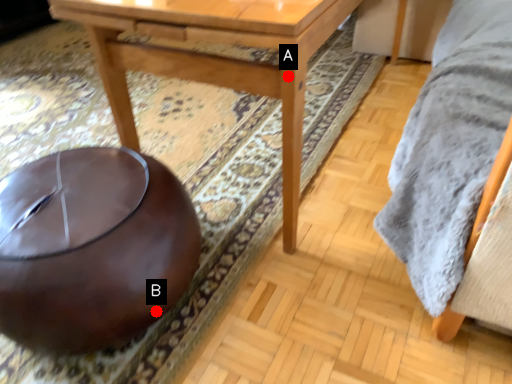
Question: Two points are circled on the image, labeled by A and B beside each circle. Which point is further to the camera?

Choices:
 (A) A is further
 (B) B is further

Answer: (B)